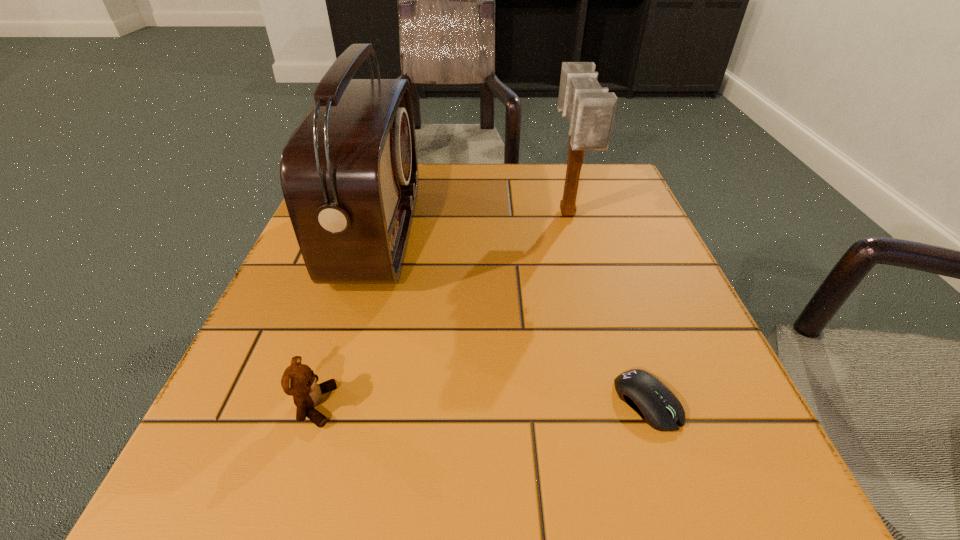
Identify the location of radio receiver that is at the left edge. This screenshot has height=540, width=960. (349, 174).

At what (x,y) coordinates should I click in order to perform the action: click on teddy bear positioned at the left edge. Please return your answer as a coordinate pair (x, y). Looking at the image, I should click on (298, 380).

Locate an element on the screen. mallet present at the right edge is located at coordinates (590, 109).

The width and height of the screenshot is (960, 540). Find the location of `computer equipment present at the right edge`. computer equipment present at the right edge is located at coordinates click(x=657, y=406).

Identify the location of object located at the far left corner. (349, 174).

The image size is (960, 540). I want to click on object at the far right corner, so click(x=590, y=109).

Locate an element on the screen. The width and height of the screenshot is (960, 540). free location at the far edge of the desktop is located at coordinates (548, 209).

This screenshot has height=540, width=960. Identify the location of blank space at the near edge of the desktop. (353, 523).

You are a GUI agent. You are given a task and a screenshot of the screen. Output one action in this format:
    pyautogui.click(x=<x>, y=<y>)
    Task: Click on the free space at the left edge
    The image size is (960, 540).
    Given the screenshot: What is the action you would take?
    pyautogui.click(x=277, y=306)

Locate an element on the screen. The height and width of the screenshot is (540, 960). free space at the right edge of the desktop is located at coordinates (663, 268).